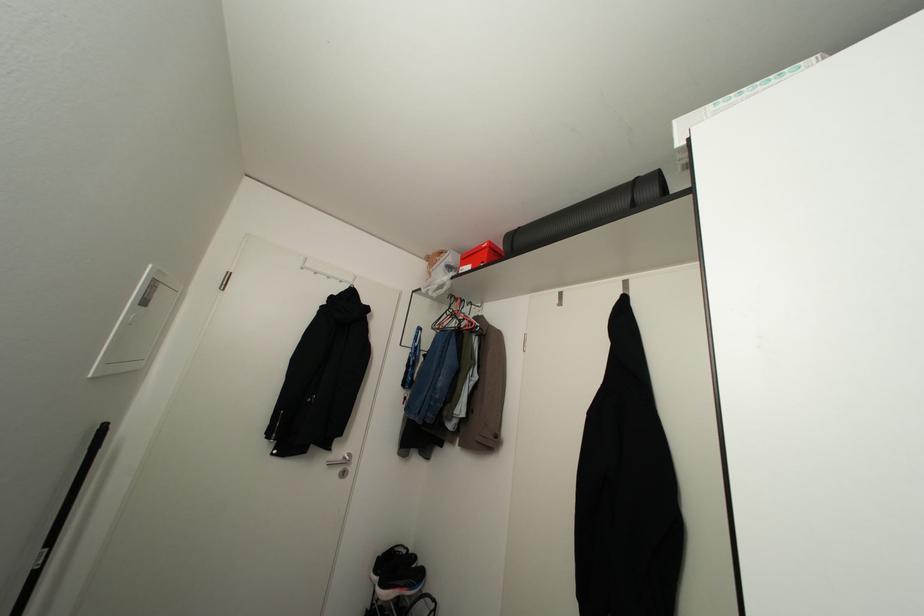
What are the coordinates of `red plastic hanger` in the screenshot? It's located at (456, 317).